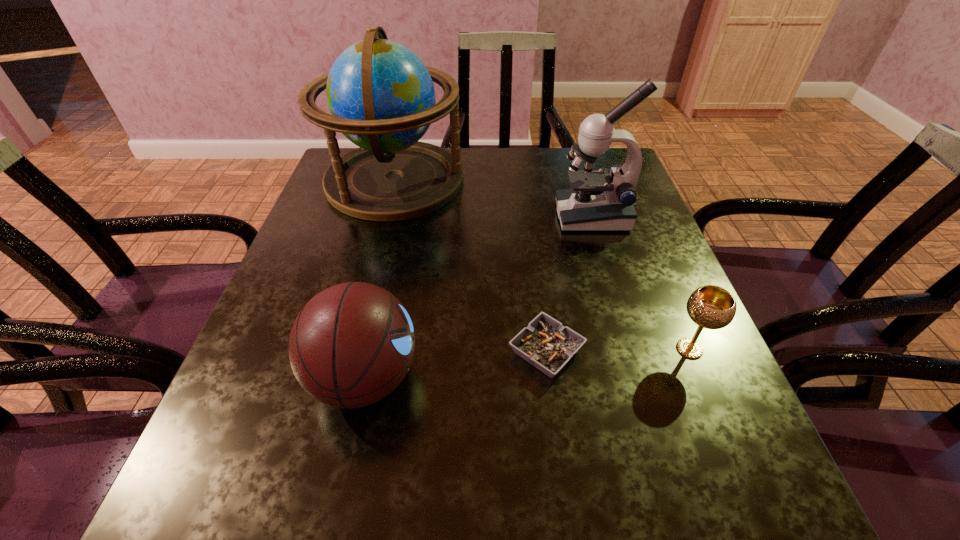
I want to click on vacant area located on the left of the ashtray, so click(281, 352).

Find the location of a particular element. object that is at the far edge is located at coordinates [x=381, y=97].

The image size is (960, 540). In order to click on globe that is at the left edge in this screenshot , I will do `click(381, 97)`.

Where is `basketball that is at the left edge`? The width and height of the screenshot is (960, 540). basketball that is at the left edge is located at coordinates (352, 344).

This screenshot has width=960, height=540. In order to click on microscope positioned at the right edge in this screenshot , I will do `click(598, 201)`.

Locate an element on the screen. The image size is (960, 540). chalice at the right edge is located at coordinates (712, 307).

Where is `object present at the far left corner`? This screenshot has width=960, height=540. object present at the far left corner is located at coordinates (381, 97).

This screenshot has width=960, height=540. I want to click on vacant space at the left edge of the desktop, so click(313, 294).

This screenshot has height=540, width=960. In the image, there is a desktop. Find the location of `vacant space at the right edge`. vacant space at the right edge is located at coordinates (667, 312).

The image size is (960, 540). I want to click on free spot at the near left corner of the desktop, so pyautogui.click(x=277, y=482).